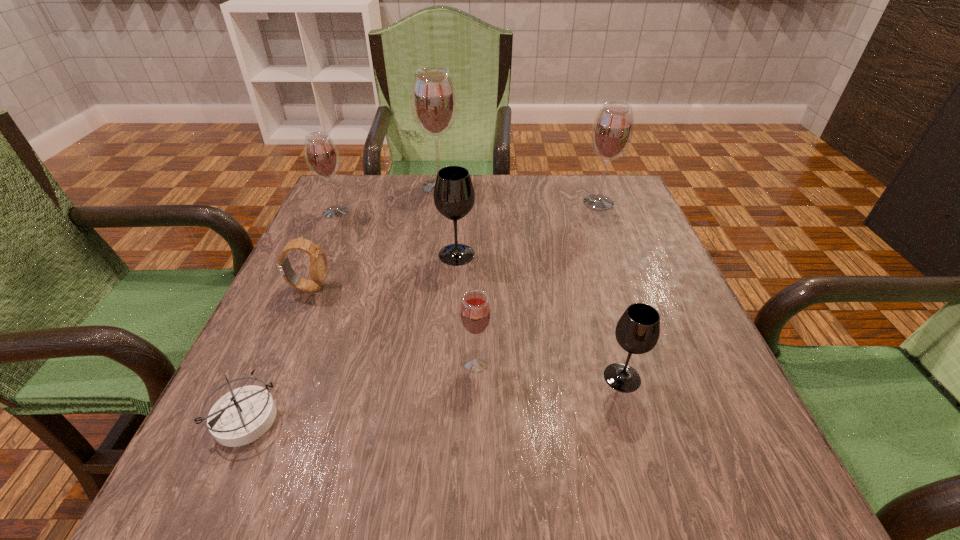
At what (x,y) coordinates should I click in order to perform the action: click on the biggest red wineglass. Please return your answer as a coordinate pair (x, y). The image size is (960, 540). Looking at the image, I should click on (434, 106).

This screenshot has width=960, height=540. I want to click on the tallest wineglass, so click(x=434, y=106).

Locate an element on the screen. the third smallest red wineglass is located at coordinates (612, 131).

The image size is (960, 540). Identify the location of the fifth shortest wineglass. (612, 131).

I want to click on the leftmost red wineglass, so click(x=321, y=155).

Locate an element on the screen. The image size is (960, 540). the second smallest red wineglass is located at coordinates (321, 155).

Find the location of a particular element. the bigger gray wineglass is located at coordinates (454, 196).

Find the location of a particular element. the left gray wineglass is located at coordinates (454, 196).

You are a GUI agent. You are given a task and a screenshot of the screen. Output one action in this format:
    pyautogui.click(x=<x>, y=<y>)
    Task: Click on the smallest red wineglass
    The width and height of the screenshot is (960, 540).
    Given the screenshot: What is the action you would take?
    [475, 314]

The height and width of the screenshot is (540, 960). What are the coordinates of `the second red wineglass from right to left` in the screenshot? It's located at (475, 314).